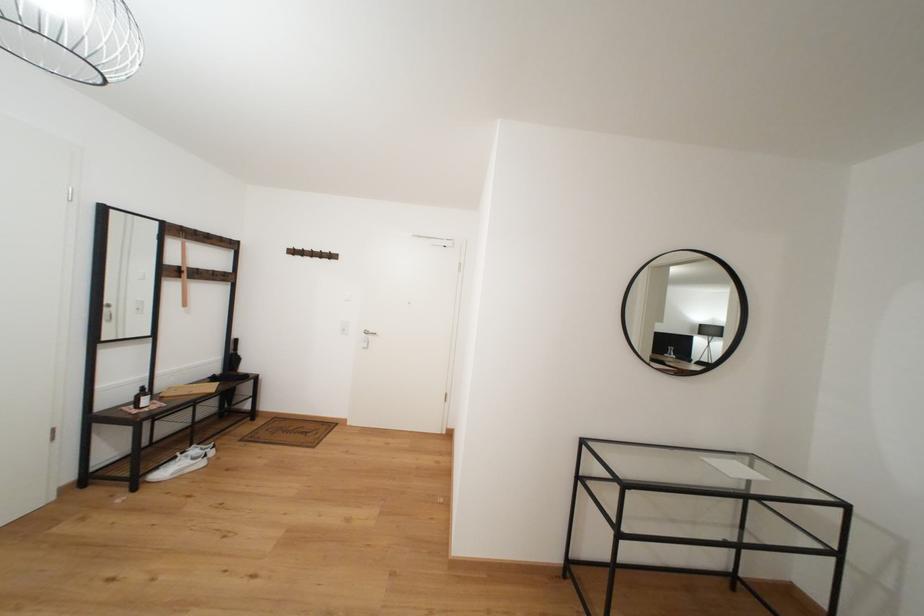
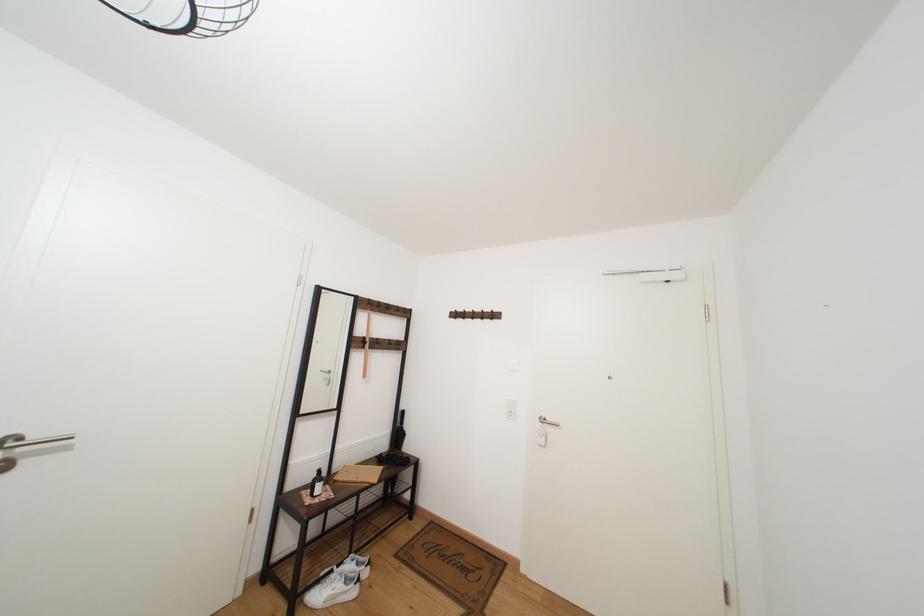
Question: The first image is from the beginning of the video and the second image is from the end. How did the camera likely rotate when shooting the video?

Choices:
 (A) Left
 (B) Right
 (C) Up
 (D) Down

Answer: (A)